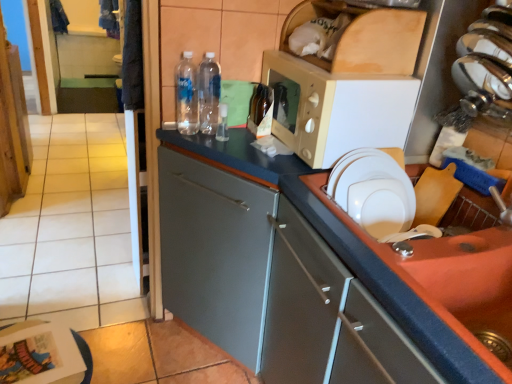
Question: Does transparent plastic bottles at center, the second bottle positioned from the left, have a greater width compared to beige plastic microwave at upper center?

Choices:
 (A) no
 (B) yes

Answer: (A)

Question: Can you confirm if transparent plastic bottles at center, the second bottle positioned from the left, is shorter than beige plastic microwave at upper center?

Choices:
 (A) no
 (B) yes

Answer: (B)

Question: Does transparent plastic bottles at center, placed as the 2th bottle when sorted from right to left, appear on the left side of beige plastic microwave at upper center?

Choices:
 (A) no
 (B) yes

Answer: (B)

Question: Is transparent plastic bottles at center, the second bottle positioned from the left, positioned beyond the bounds of beige plastic microwave at upper center?

Choices:
 (A) yes
 (B) no

Answer: (A)

Question: Is transparent plastic bottles at center, placed as the 2th bottle when sorted from right to left, further to the viewer compared to beige plastic microwave at upper center?

Choices:
 (A) yes
 (B) no

Answer: (A)

Question: Considering the relative positions of orange matte sink at lower right and clear plastic bottle at center, the first bottle in the left-to-right sequence, in the image provided, is orange matte sink at lower right to the left or to the right of clear plastic bottle at center, the first bottle in the left-to-right sequence,?

Choices:
 (A) left
 (B) right

Answer: (B)

Question: Is point (458, 279) positioned closer to the camera than point (179, 99)?

Choices:
 (A) farther
 (B) closer

Answer: (B)

Question: Considering the positions of orange matte sink at lower right and clear plastic bottle at center, placed as the third bottle when sorted from right to left, in the image, is orange matte sink at lower right wider or thinner than clear plastic bottle at center, placed as the third bottle when sorted from right to left,?

Choices:
 (A) thin
 (B) wide

Answer: (B)

Question: Is orange matte sink at lower right taller or shorter than clear plastic bottle at center, placed as the third bottle when sorted from right to left?

Choices:
 (A) tall
 (B) short

Answer: (B)

Question: From the image's perspective, relative to matte gray cabinet at center, is translucent glass bottle at center, the third bottle viewed from the left, above or below?

Choices:
 (A) above
 (B) below

Answer: (A)

Question: In terms of height, does translucent glass bottle at center, marked as the 1th bottle in a right-to-left arrangement, look taller or shorter compared to matte gray cabinet at center?

Choices:
 (A) tall
 (B) short

Answer: (B)

Question: Looking at their shapes, would you say translucent glass bottle at center, marked as the 1th bottle in a right-to-left arrangement, is wider or thinner than matte gray cabinet at center?

Choices:
 (A) wide
 (B) thin

Answer: (B)

Question: Relative to matte gray cabinet at center, is translucent glass bottle at center, marked as the 1th bottle in a right-to-left arrangement, in front or behind?

Choices:
 (A) front
 (B) behind

Answer: (B)

Question: Is white matte paper plate at right situated inside matte gray cabinet at center or outside?

Choices:
 (A) outside
 (B) inside

Answer: (A)

Question: Does point (386, 167) appear closer or farther from the camera than point (298, 299)?

Choices:
 (A) farther
 (B) closer

Answer: (A)